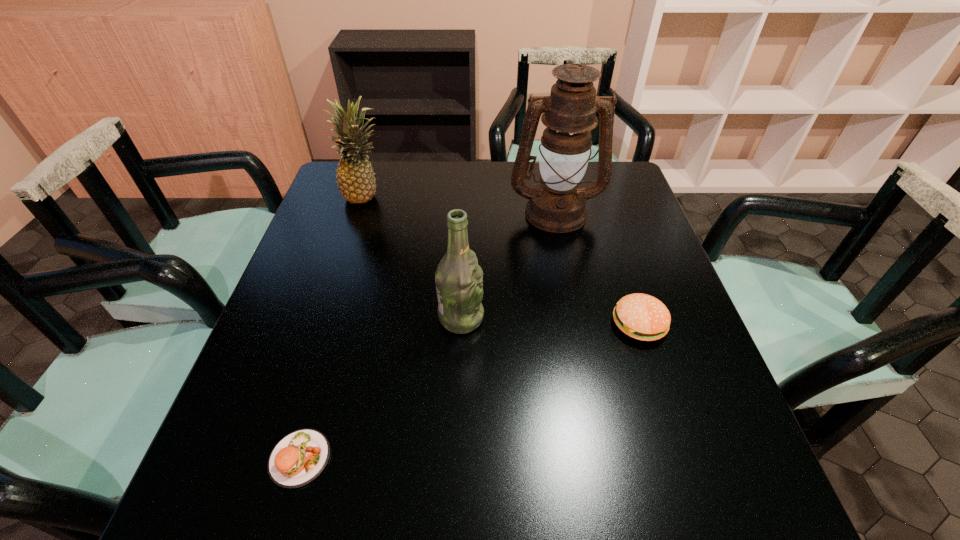
Where is `object positioned at the near left corner`? object positioned at the near left corner is located at coordinates (300, 457).

Find the location of a particular element. The width and height of the screenshot is (960, 540). object positioned at the far right corner is located at coordinates (557, 205).

Identify the location of vacant space at the far edge of the desktop. This screenshot has width=960, height=540. (475, 185).

Image resolution: width=960 pixels, height=540 pixels. In order to click on free space at the near edge of the desktop in this screenshot , I will do `click(470, 490)`.

Where is `vacant space at the left edge of the desktop`? This screenshot has width=960, height=540. vacant space at the left edge of the desktop is located at coordinates (305, 319).

Where is `vacant area at the right edge`? Image resolution: width=960 pixels, height=540 pixels. vacant area at the right edge is located at coordinates (650, 251).

Where is `vacant space at the near right corner of the desktop`? The width and height of the screenshot is (960, 540). vacant space at the near right corner of the desktop is located at coordinates (668, 470).

Identify the location of free space between the third object from right to left and the pineapple. (414, 257).

Find the location of `free spot between the third object from left to right and the tallest object`. free spot between the third object from left to right and the tallest object is located at coordinates (508, 265).

I want to click on empty space that is in between the tallest object and the third object from left to right, so click(508, 265).